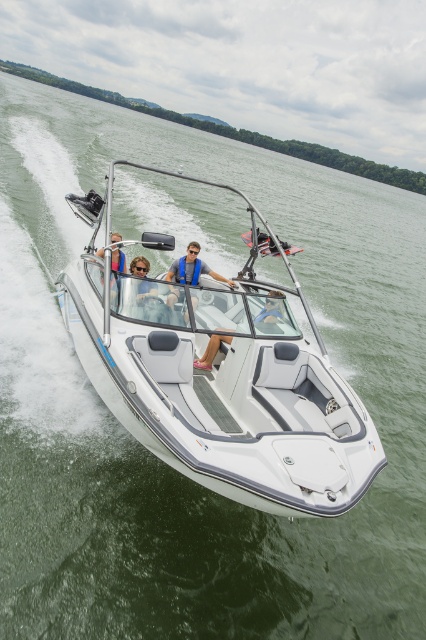
You are a photographer trying to capture a clear shot of the white matte boat at center and the matte black sunglasses at center from a drone. Since the sunglasses are smaller than the boat, will you need to adjust your drone camera angle to focus on the sunglasses first?

The white matte boat at center is much taller than the matte black sunglasses at center, so you need to adjust the drone camera angle to focus on the matte black sunglasses at center first to ensure they are in frame and properly captured.

You are standing on the dock and looking at the white speedboat in the water. There are two points marked on the boat, point A at coordinates point [167,337] and point B at coordinates point [143,260]. Which point is closer to you?

Point A at coordinates point [167,337] is closer to the viewer than point B at coordinates point [143,260].